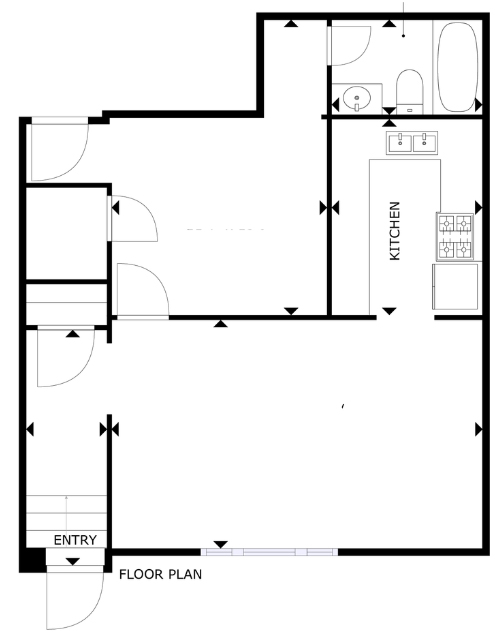
At what (x,y) coordinates should I click in order to perform the action: click on toilet. Please return your answer as a coordinate pair (x, y). This screenshot has width=500, height=642. Looking at the image, I should click on (409, 92).